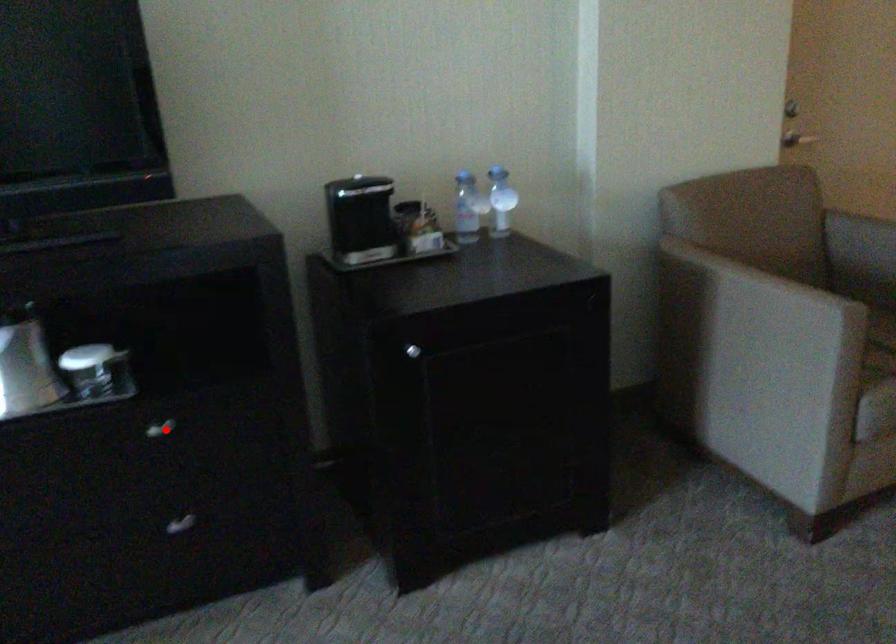
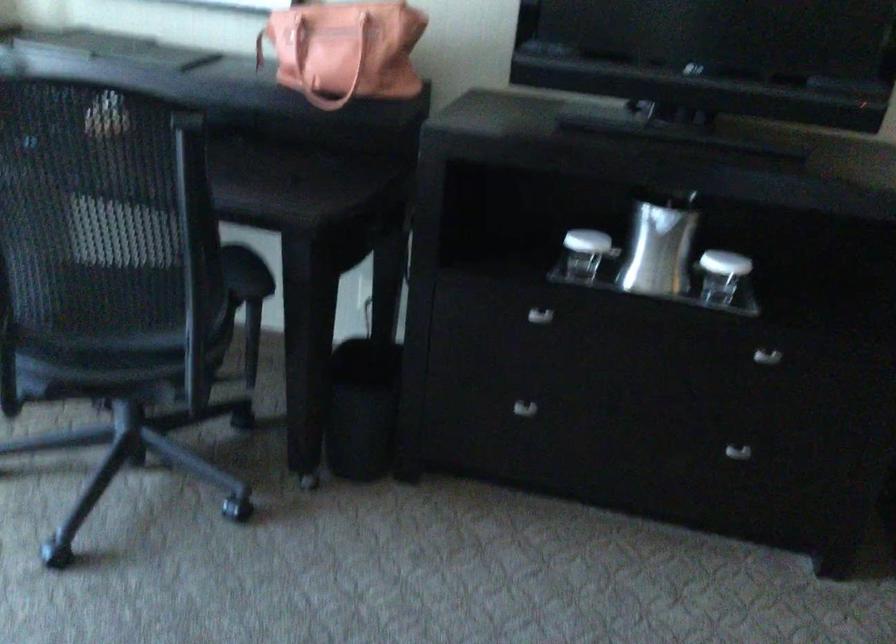
In the second image, find the point that corresponds to the highlighted location in the first image.

(767, 357)